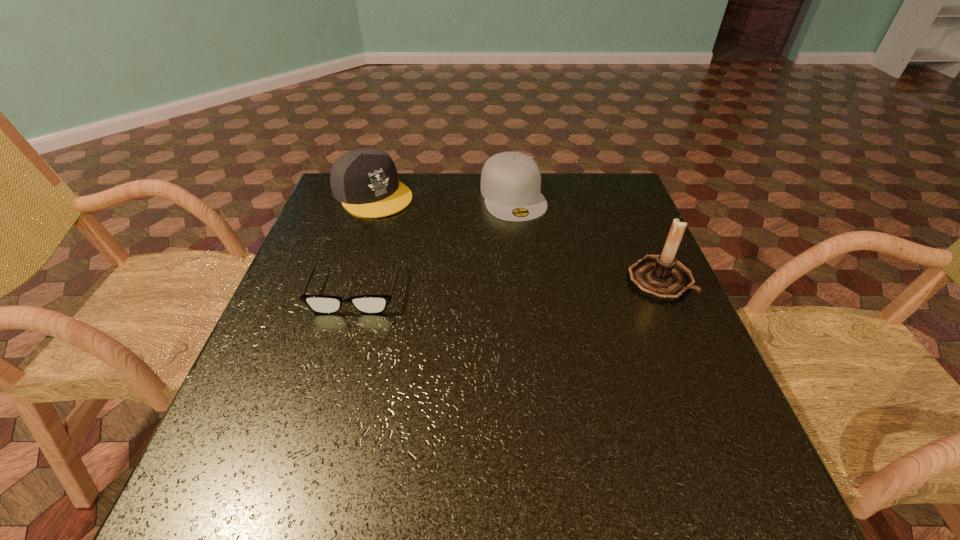
In the image, there is a desktop. Find the location of `free region at the right edge`. free region at the right edge is located at coordinates (680, 353).

In order to click on vacant space at the far left corner of the desktop in this screenshot , I will do `click(338, 208)`.

I want to click on unoccupied position between the second object from right to left and the spectacles, so click(435, 243).

Where is `vacant space that's between the candle holder and the spectacles`? The image size is (960, 540). vacant space that's between the candle holder and the spectacles is located at coordinates (508, 285).

The height and width of the screenshot is (540, 960). In order to click on vacant area between the right cap and the tallest object in this screenshot , I will do `click(587, 238)`.

Where is `free space between the second object from right to left and the shortest object`? The width and height of the screenshot is (960, 540). free space between the second object from right to left and the shortest object is located at coordinates (435, 243).

Find the location of a particular element. The width and height of the screenshot is (960, 540). free space between the right cap and the left cap is located at coordinates (443, 195).

Identify the location of vacant point located between the candle holder and the third object from left to right. This screenshot has height=540, width=960. (587, 238).

Where is `vacant space in between the left cap and the second object from right to left`? Image resolution: width=960 pixels, height=540 pixels. vacant space in between the left cap and the second object from right to left is located at coordinates (443, 195).

Identify the location of vacant region between the rightmost object and the third object from left to right. (587, 238).